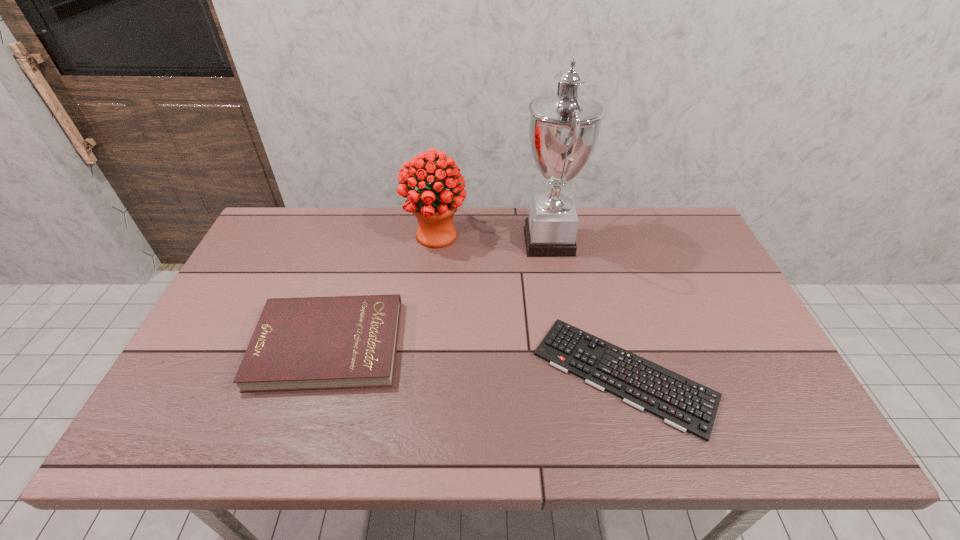
In order to click on trophy cup positioned at the far edge in this screenshot , I will do `click(564, 127)`.

You are a GUI agent. You are given a task and a screenshot of the screen. Output one action in this format:
    pyautogui.click(x=<x>, y=<y>)
    Task: Click on the bouquet that is at the far edge
    This screenshot has width=960, height=540.
    Given the screenshot: What is the action you would take?
    pyautogui.click(x=434, y=206)

Locate an element on the screen. The width and height of the screenshot is (960, 540). object that is at the near edge is located at coordinates (682, 403).

Find the location of `object present at the left edge`. object present at the left edge is located at coordinates (307, 343).

Find the location of a particular element. The height and width of the screenshot is (540, 960). object situated at the right edge is located at coordinates (682, 403).

Locate an element on the screen. Image resolution: width=960 pixels, height=540 pixels. object that is at the near right corner is located at coordinates (682, 403).

Image resolution: width=960 pixels, height=540 pixels. I want to click on free space at the far edge of the desktop, so click(376, 244).

Locate an element on the screen. vacant space at the near edge is located at coordinates (434, 413).

The width and height of the screenshot is (960, 540). In the image, there is a desktop. Identify the location of free region at the left edge. coord(204,369).

Where is `vacant space at the right edge of the desktop`? This screenshot has width=960, height=540. vacant space at the right edge of the desktop is located at coordinates (743, 398).